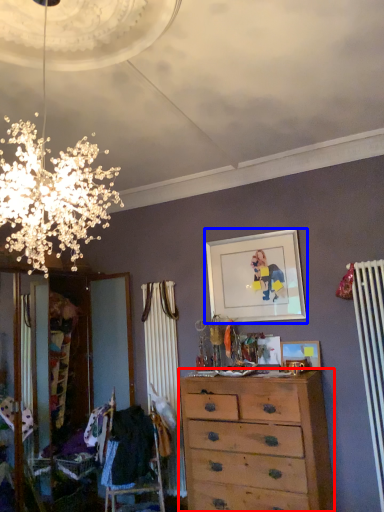
Question: Among these objects, which one is nearest to the camera, chest of drawers (highlighted by a red box) or picture frame (highlighted by a blue box)?

Choices:
 (A) chest of drawers
 (B) picture frame

Answer: (A)